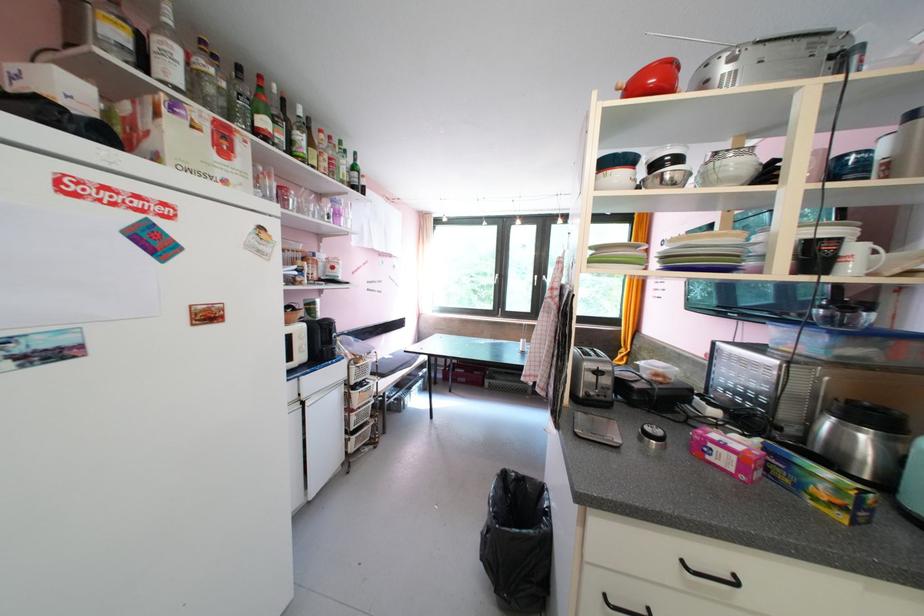
The width and height of the screenshot is (924, 616). What are the coordinates of `the bottom black cabinet handle` in the screenshot? It's located at (624, 608).